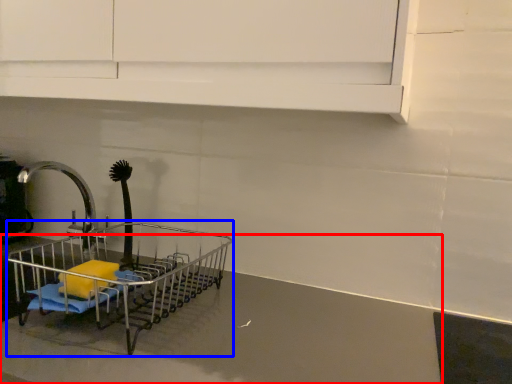
Question: Which point is closer to the camera, counter top (highlighted by a red box) or shopping cart (highlighted by a blue box)?

Choices:
 (A) counter top
 (B) shopping cart

Answer: (A)